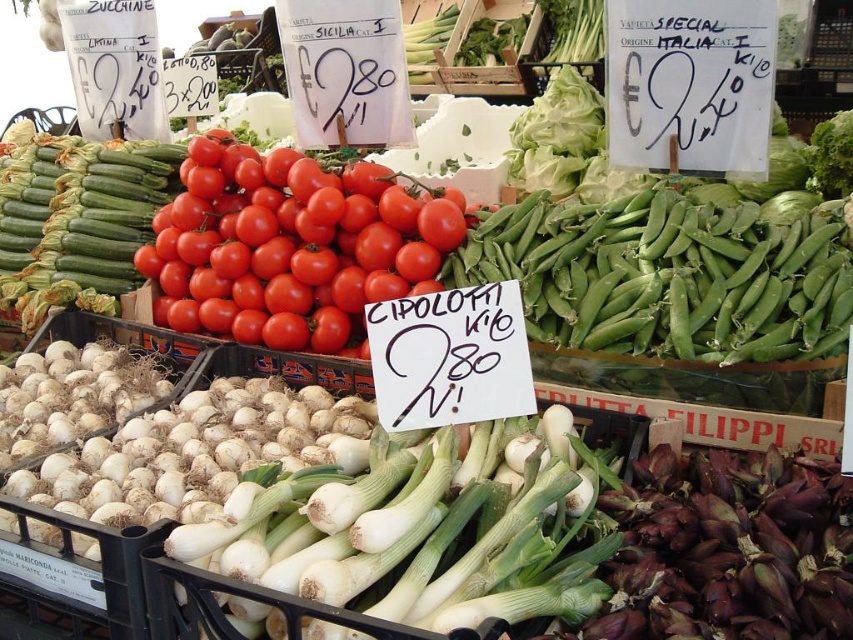
You are a customer at the market stall looking to buy vegetables. You want to know which vegetable is taller between the shiny red tomatoes at center and the green matte zucchini at upper left. Can you tell me which one is taller?

The shiny red tomatoes at center is much taller than the green matte zucchini at upper left according to the description.

What is located at the point with coordinates (x=664, y=276) in the image?

The point at coordinates (x=664, y=276) marks green smooth peas at upper right.